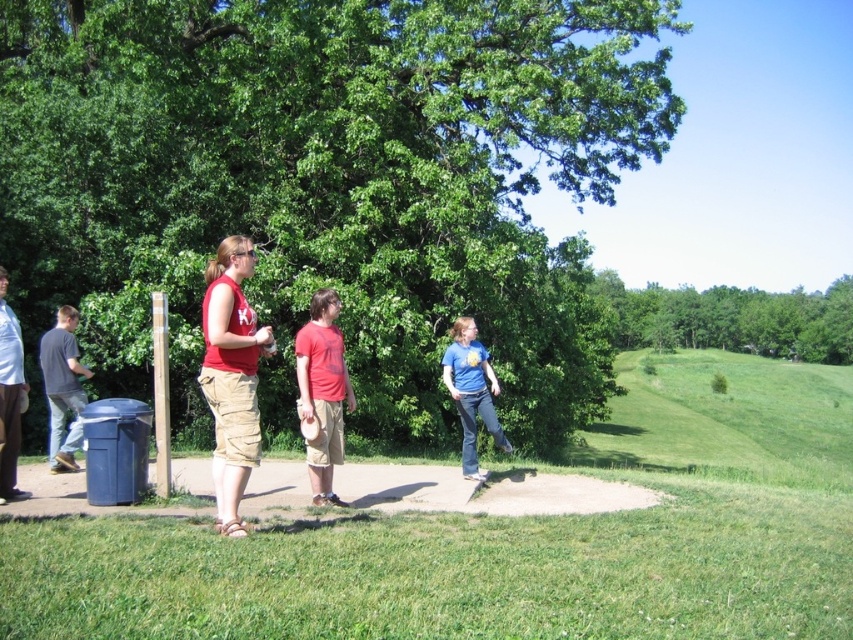
Question: Which object is closer to the camera taking this photo?

Choices:
 (A) green leafy tree at upper center
 (B) blue cotton shirt at center

Answer: (B)

Question: Is green leafy tree at center behind matte red tank top at center?

Choices:
 (A) yes
 (B) no

Answer: (A)

Question: Which object appears closest to the camera in this image?

Choices:
 (A) dark gray jeans at left
 (B) green leafy tree at upper center

Answer: (A)

Question: Estimate the real-world distances between objects in this image. Which object is farther from the dark gray jeans at left?

Choices:
 (A) matte red tank top at center
 (B) matte gray shirt at left
 (C) green leafy tree at center

Answer: (C)

Question: From the image, what is the correct spatial relationship of green leafy tree at center in relation to dark gray jeans at left?

Choices:
 (A) left
 (B) right

Answer: (B)

Question: In this image, where is dark gray jeans at left located relative to blue cotton shirt at center?

Choices:
 (A) above
 (B) below

Answer: (A)